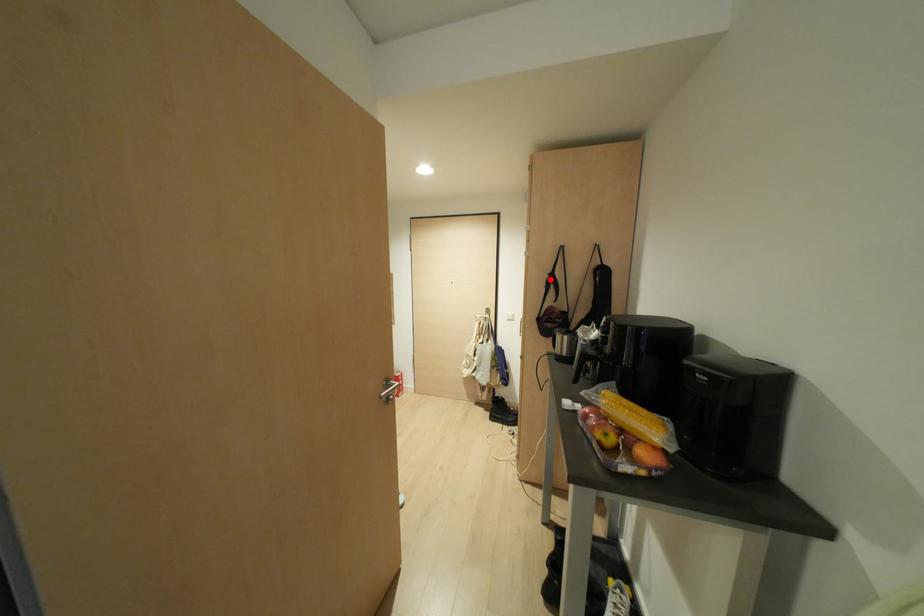
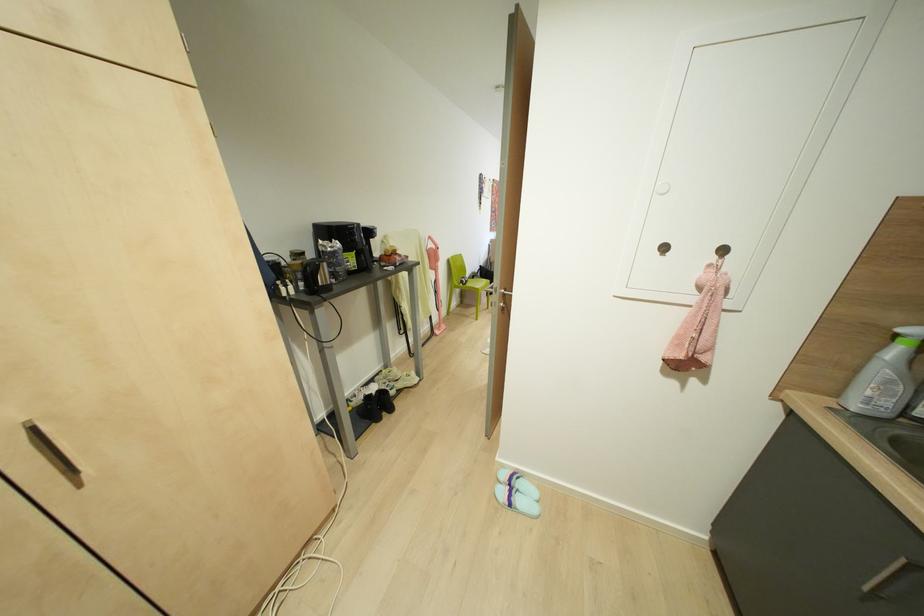
Question: I am providing you with two images of the same scene from different viewpoints. A red point is marked on the first image. Can you still see the location of the red point in image 2?

Choices:
 (A) Yes
 (B) No

Answer: (B)